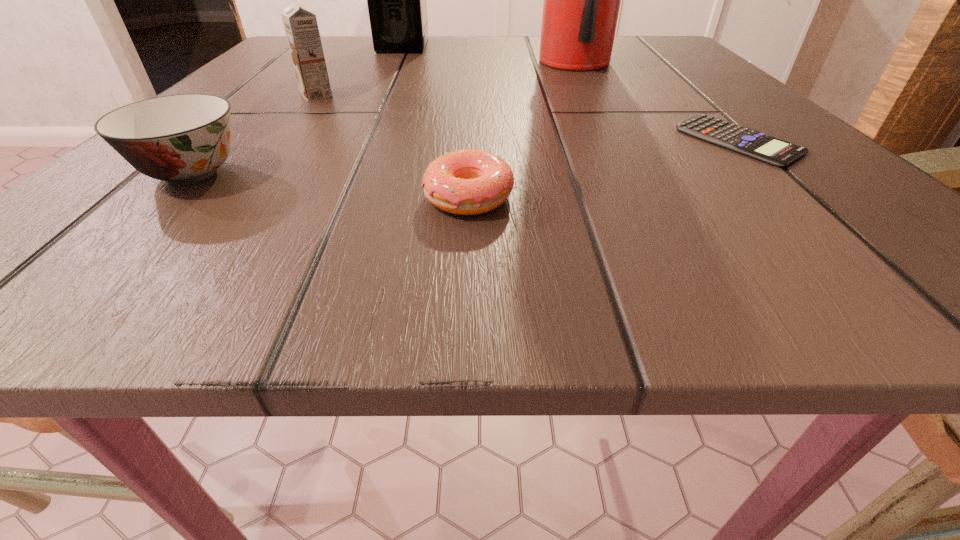
Find the location of `the shortest object`. the shortest object is located at coordinates (x=753, y=143).

I want to click on free space located on the hose direction of the tallest object, so click(633, 167).

At what (x,y) coordinates should I click in order to perform the action: click on vacant space located on the front label of the fourth object from right to left. Please return your answer as a coordinate pair (x, y). The width and height of the screenshot is (960, 540). Looking at the image, I should click on click(481, 45).

Locate an element on the screen. vacant space situated on the back of the chocolate milk is located at coordinates (358, 44).

The width and height of the screenshot is (960, 540). I want to click on free region located 0.190m on the right of the third shortest object, so 420,173.

Where is `free point located on the back of the third object from right to left`? The height and width of the screenshot is (540, 960). free point located on the back of the third object from right to left is located at coordinates (472, 76).

At what (x,y) coordinates should I click in order to perform the action: click on vacant space located on the left of the calculator. Please return your answer as a coordinate pair (x, y). This screenshot has width=960, height=540. Looking at the image, I should click on (620, 141).

Where is `fire extinguisher positioned at the far edge`? The image size is (960, 540). fire extinguisher positioned at the far edge is located at coordinates (581, 5).

Identify the location of liquor present at the far edge. (397, 6).

Find the location of a particular element. This screenshot has height=540, width=960. chocolate milk that is at the left edge is located at coordinates (301, 28).